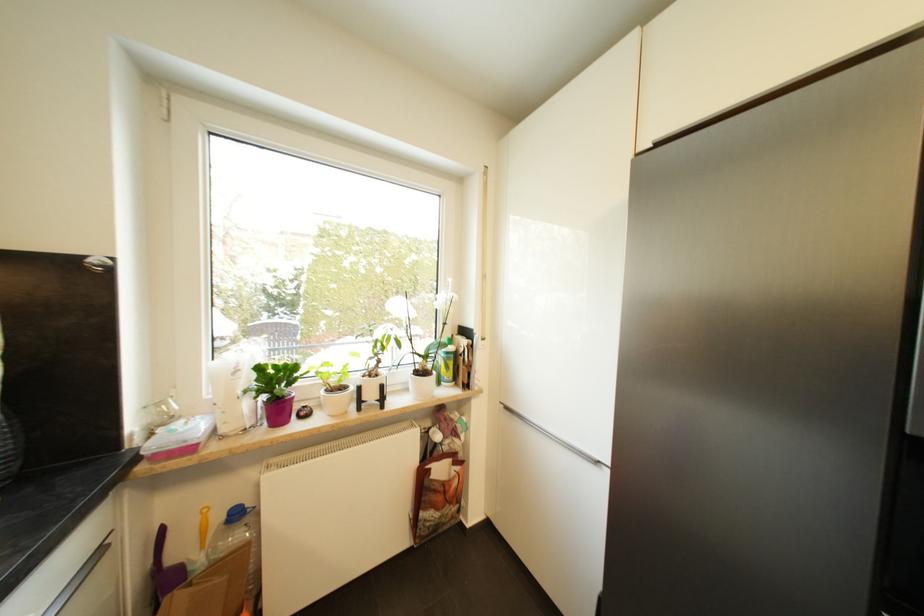
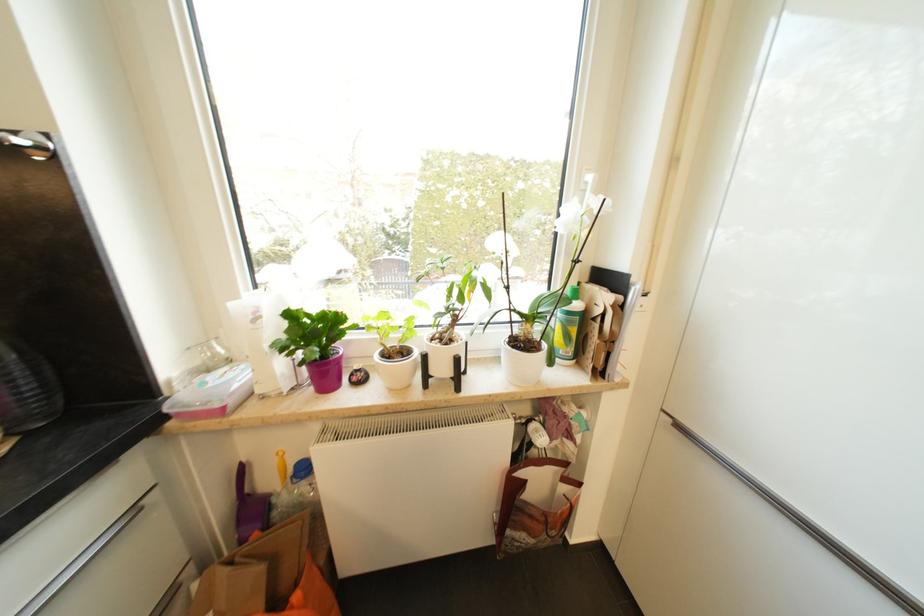
Locate, in the second image, the point that corresponds to point 512,410 in the first image.

(685, 429)